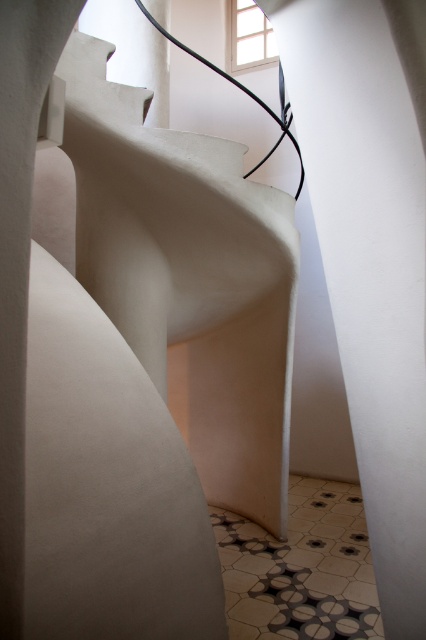
Based on the photo, is white matte staircase at center above white matte wall at center?

Yes, white matte staircase at center is above white matte wall at center.

Locate an element on the screen. This screenshot has height=640, width=426. white matte staircase at center is located at coordinates (189, 276).

This screenshot has width=426, height=640. I want to click on white matte staircase at center, so click(x=189, y=276).